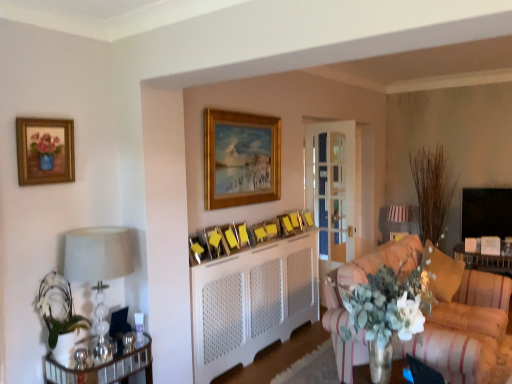
Question: Considering the relative positions of yellow paper at center, the 7th picture frame positioned from the back, and matte yellow picture frame at center, placed as the 5th picture frame when sorted from back to front, in the image provided, is yellow paper at center, the 7th picture frame positioned from the back, to the left of matte yellow picture frame at center, placed as the 5th picture frame when sorted from back to front, from the viewer's perspective?

Choices:
 (A) no
 (B) yes

Answer: (B)

Question: From the image's perspective, is yellow paper at center, which ranks as the 5th picture frame in front-to-back order, under matte yellow picture frame at center, positioned as the seventh picture frame in front-to-back order?

Choices:
 (A) yes
 (B) no

Answer: (B)

Question: Is yellow paper at center, which ranks as the 5th picture frame in front-to-back order, bigger than matte yellow picture frame at center, placed as the 5th picture frame when sorted from back to front?

Choices:
 (A) no
 (B) yes

Answer: (B)

Question: From a real-world perspective, is yellow paper at center, which ranks as the 5th picture frame in front-to-back order, positioned under matte yellow picture frame at center, positioned as the seventh picture frame in front-to-back order, based on gravity?

Choices:
 (A) yes
 (B) no

Answer: (B)

Question: Is yellow paper at center, which ranks as the 5th picture frame in front-to-back order, located outside matte yellow picture frame at center, placed as the 5th picture frame when sorted from back to front?

Choices:
 (A) no
 (B) yes

Answer: (B)

Question: Is yellow paper at center, which ranks as the 5th picture frame in front-to-back order, far from matte yellow picture frame at center, placed as the 5th picture frame when sorted from back to front?

Choices:
 (A) yes
 (B) no

Answer: (B)

Question: Considering the relative positions of wooden picture frame at center, positioned as the 10th picture frame in front-to-back order, and matte yellow picture frame at center, positioned as the seventh picture frame in front-to-back order, in the image provided, is wooden picture frame at center, positioned as the 10th picture frame in front-to-back order, behind matte yellow picture frame at center, positioned as the seventh picture frame in front-to-back order,?

Choices:
 (A) yes
 (B) no

Answer: (A)

Question: Is wooden picture frame at center, marked as the 2th picture frame in a back-to-front arrangement, at the right side of matte yellow picture frame at center, placed as the 5th picture frame when sorted from back to front?

Choices:
 (A) no
 (B) yes

Answer: (B)

Question: Can you confirm if wooden picture frame at center, positioned as the 10th picture frame in front-to-back order, is bigger than matte yellow picture frame at center, placed as the 5th picture frame when sorted from back to front?

Choices:
 (A) yes
 (B) no

Answer: (B)

Question: Is matte yellow picture frame at center, positioned as the seventh picture frame in front-to-back order, a part of wooden picture frame at center, marked as the 2th picture frame in a back-to-front arrangement?

Choices:
 (A) yes
 (B) no

Answer: (B)

Question: Would you say wooden picture frame at center, positioned as the 10th picture frame in front-to-back order, is a long distance from matte yellow picture frame at center, positioned as the seventh picture frame in front-to-back order?

Choices:
 (A) no
 (B) yes

Answer: (A)

Question: From the image's perspective, would you say wooden picture frame at center, marked as the 2th picture frame in a back-to-front arrangement, is shown under matte yellow picture frame at center, positioned as the seventh picture frame in front-to-back order?

Choices:
 (A) yes
 (B) no

Answer: (B)

Question: Is white striped lampshade at upper right, which ranks as the first lamp in back-to-front order, taller than striped fabric couch at lower right?

Choices:
 (A) no
 (B) yes

Answer: (A)